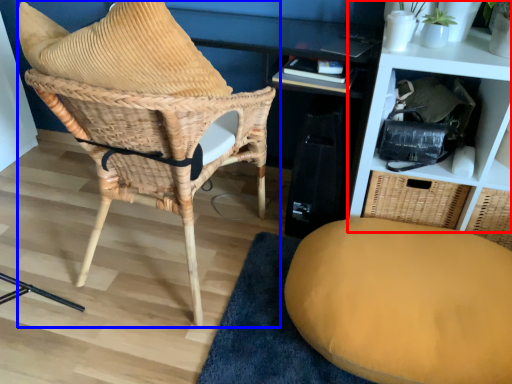
Question: Which object is further to the camera taking this photo, shelf (highlighted by a red box) or chair (highlighted by a blue box)?

Choices:
 (A) shelf
 (B) chair

Answer: (A)